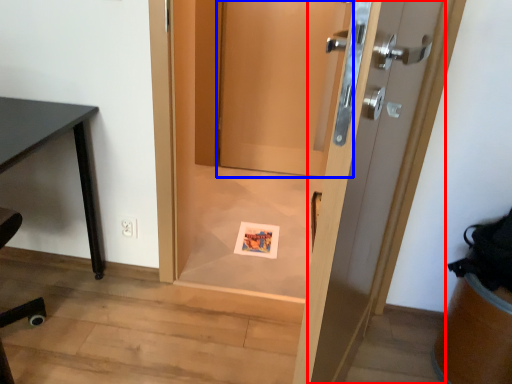
Question: Which object is further to the camera taking this photo, door (highlighted by a red box) or door (highlighted by a blue box)?

Choices:
 (A) door
 (B) door

Answer: (B)